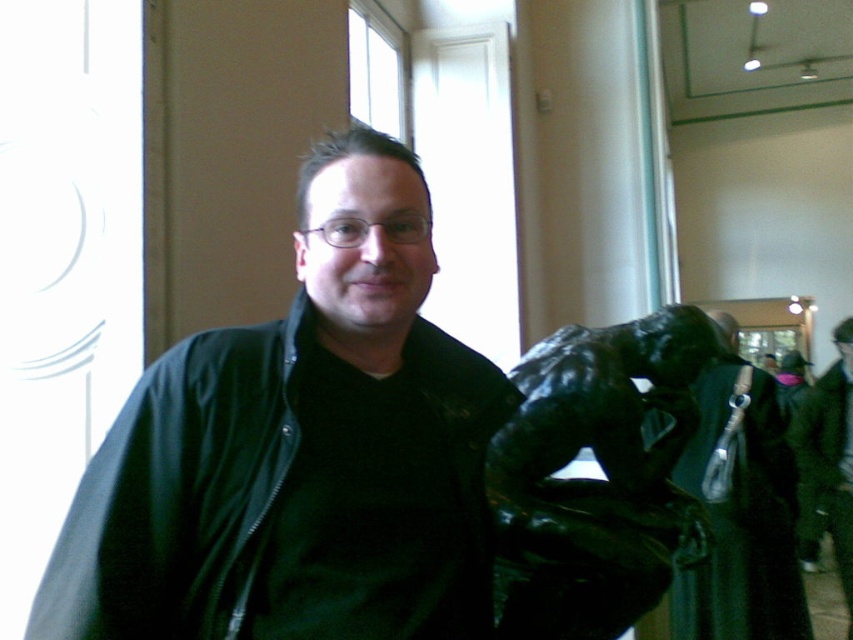
You are a museum visitor who wants to take a photo of the sculptures in the background without any obstruction. The green matte jacket at center and the black matte jacket at center are in your way. Which jacket should you ask the person to move so that you can take the photo?

The green matte jacket at center is positioned over black matte jacket at center, so you should ask the person to move the green matte jacket at center to avoid obstruction.

You are standing in the museum and want to take a photo of the black bronze statue at center. Where should you position yourself to ensure the statue is centered in your camera viewfinder?

To center the black bronze statue at center in your camera viewfinder, position yourself directly in front of the statue at its 2D coordinates point (x=596, y=480).